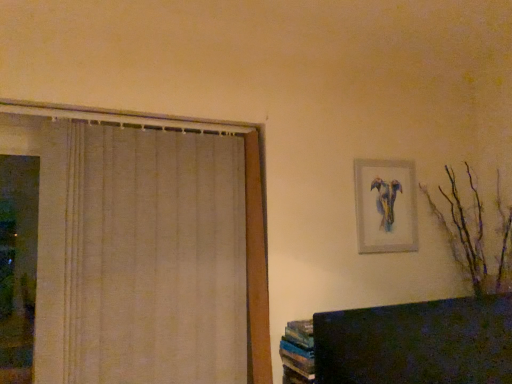
Question: Is matte silver picture frame at upper right inside or outside of brown matte branches at right?

Choices:
 (A) outside
 (B) inside

Answer: (A)

Question: In the image, is matte silver picture frame at upper right positioned in front of or behind brown matte branches at right?

Choices:
 (A) behind
 (B) front

Answer: (A)

Question: Which is farther from the matte silver picture frame at upper right?

Choices:
 (A) beige fabric curtain at left
 (B) brown matte branches at right

Answer: (A)

Question: Which of these objects is positioned farthest from the matte silver picture frame at upper right?

Choices:
 (A) brown matte branches at right
 (B) beige fabric curtain at left

Answer: (B)